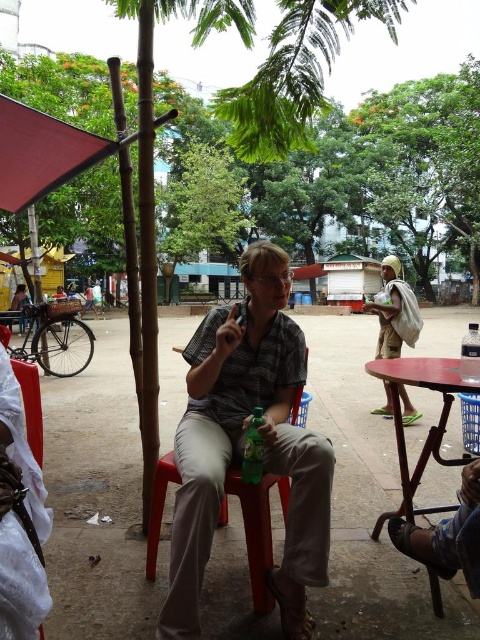
Question: Which point is closer to the camera?

Choices:
 (A) (392, 371)
 (B) (308, 550)
 (C) (56, 172)
 (D) (457, 182)

Answer: (B)

Question: Does green leafy tree at upper center have a lesser width compared to matte plastic stool at center?

Choices:
 (A) yes
 (B) no

Answer: (B)

Question: Which of the following is the farthest from the observer?

Choices:
 (A) matte gray shirt at center
 (B) matte red canopy at upper left
 (C) wooden table at lower right

Answer: (B)

Question: Where is matte gray shirt at center located in relation to wooden table at lower right in the image?

Choices:
 (A) below
 (B) above

Answer: (B)

Question: Where is matte gray shirt at center located in relation to matte plastic stool at center in the image?

Choices:
 (A) left
 (B) right

Answer: (B)

Question: Which point is farther to the camera?

Choices:
 (A) matte gray shirt at center
 (B) green leafy tree at upper center

Answer: (B)